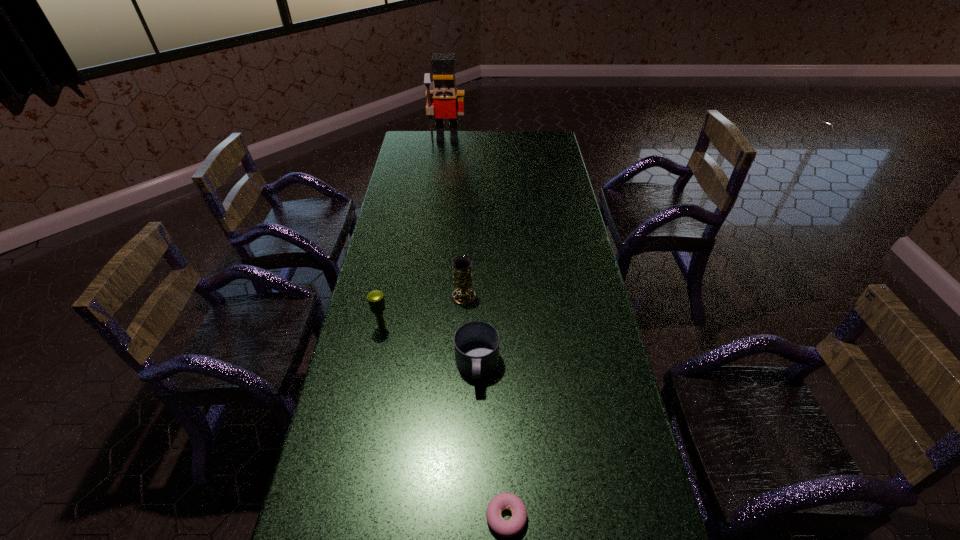
Find the location of `nutcracker`. nutcracker is located at coordinates (444, 100).

You are a GUI agent. You are given a task and a screenshot of the screen. Output one action in this format:
    pyautogui.click(x=<x>, y=<y>)
    Task: Click on the farthest object
    
    Given the screenshot: What is the action you would take?
    pyautogui.click(x=444, y=100)

Where is `chalice`? chalice is located at coordinates (462, 265).

The width and height of the screenshot is (960, 540). In order to click on the fourth farthest object in this screenshot , I will do `click(377, 305)`.

Where is `the leftmost object`? This screenshot has height=540, width=960. the leftmost object is located at coordinates (377, 305).

In order to click on the third shortest object in this screenshot , I will do `click(476, 343)`.

The image size is (960, 540). Identify the location of the fifth farthest object. (476, 343).

Where is `the fifth nearest object`? the fifth nearest object is located at coordinates (474, 208).

You are a GUI agent. You are given a task and a screenshot of the screen. Output one action in this format:
    pyautogui.click(x=<x>, y=<y>)
    Task: Click on the doughnut
    
    Given the screenshot: What is the action you would take?
    pyautogui.click(x=509, y=528)

I want to click on free location located 0.150m in front of the nutcracker holding the staff, so click(x=444, y=161).